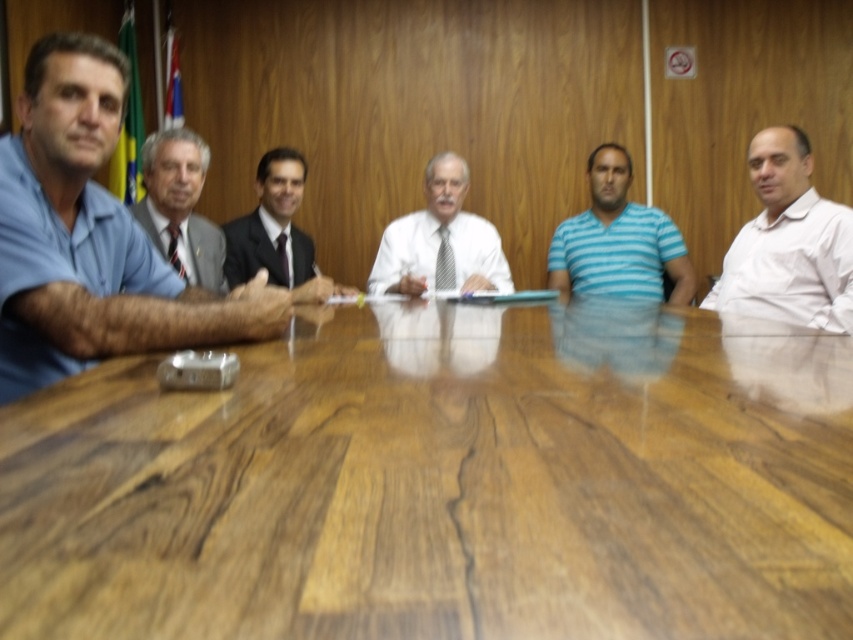
This screenshot has width=853, height=640. What do you see at coordinates (440, 241) in the screenshot?
I see `white glossy shirt at center` at bounding box center [440, 241].

Which is more to the right, white glossy shirt at center or gray suit at center?

From the viewer's perspective, white glossy shirt at center appears more on the right side.

This screenshot has width=853, height=640. Find the location of `white glossy shirt at center`. white glossy shirt at center is located at coordinates (440, 241).

Does blue striped shirt at center have a greater width compared to gray suit at center?

Yes.

Is blue striped shirt at center bigger than gray suit at center?

Correct, blue striped shirt at center is larger in size than gray suit at center.

This screenshot has width=853, height=640. Describe the element at coordinates (618, 240) in the screenshot. I see `blue striped shirt at center` at that location.

Where is `blue striped shirt at center`? The width and height of the screenshot is (853, 640). blue striped shirt at center is located at coordinates (618, 240).

Does wooden table at center lie behind white shirt at right?

No.

Does point (567, 513) come closer to viewer compared to point (798, 275)?

Yes, point (567, 513) is in front of point (798, 275).

Locate an element on the screen. The image size is (853, 640). wooden table at center is located at coordinates (444, 483).